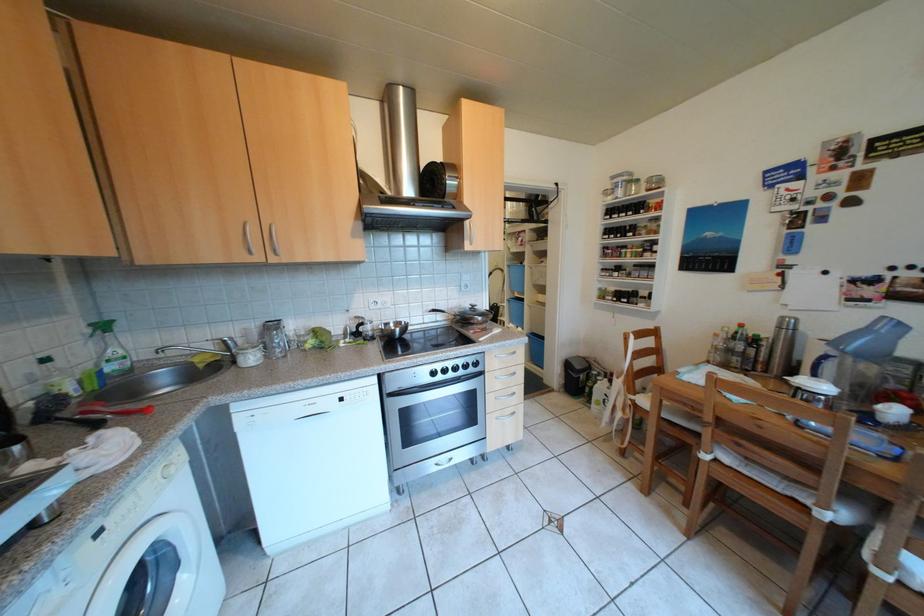
You are a GUI agent. You are given a task and a screenshot of the screen. Output one action in this format:
    pyautogui.click(x=<x>, y=<y>)
    Task: Click on the silver oven handle
    This screenshot has height=616, width=924.
    Given the screenshot: What is the action you would take?
    pyautogui.click(x=433, y=385)